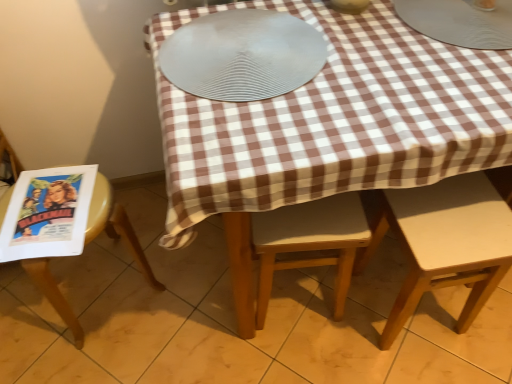
You are a GUI agent. You are given a task and a screenshot of the screen. Output one action in this format:
    pyautogui.click(x=<x>, y=<y>)
    Task: Click on the vacant region to the right of yellow plastic chair at left, acting as the first chair starting from the left
    
    Given the screenshot: What is the action you would take?
    pyautogui.click(x=181, y=297)